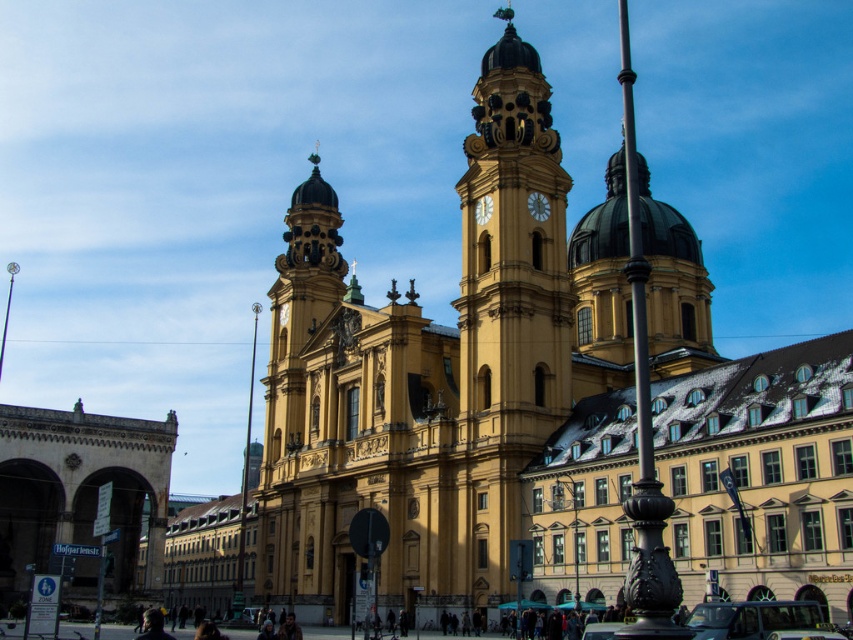
Question: Does yellow stone clock tower at center come behind yellow stone clock at center?

Choices:
 (A) no
 (B) yes

Answer: (A)

Question: Which of the following is the farthest from the observer?

Choices:
 (A) yellow stone clock tower at center
 (B) metallic gold clock at center
 (C) yellow stone clock at center

Answer: (C)

Question: Does yellow stone clock tower at center come in front of metallic gold clock at center?

Choices:
 (A) yes
 (B) no

Answer: (A)

Question: Which object is closer to the camera taking this photo?

Choices:
 (A) yellow stone clock tower at center
 (B) metallic gold clock at center

Answer: (A)

Question: Which of these objects is positioned closest to the yellow stone clock tower at center?

Choices:
 (A) metallic gold clock at center
 (B) yellow stone clock at center

Answer: (A)

Question: Can you confirm if metallic gold clock at center is positioned to the right of yellow stone clock at center?

Choices:
 (A) yes
 (B) no

Answer: (A)